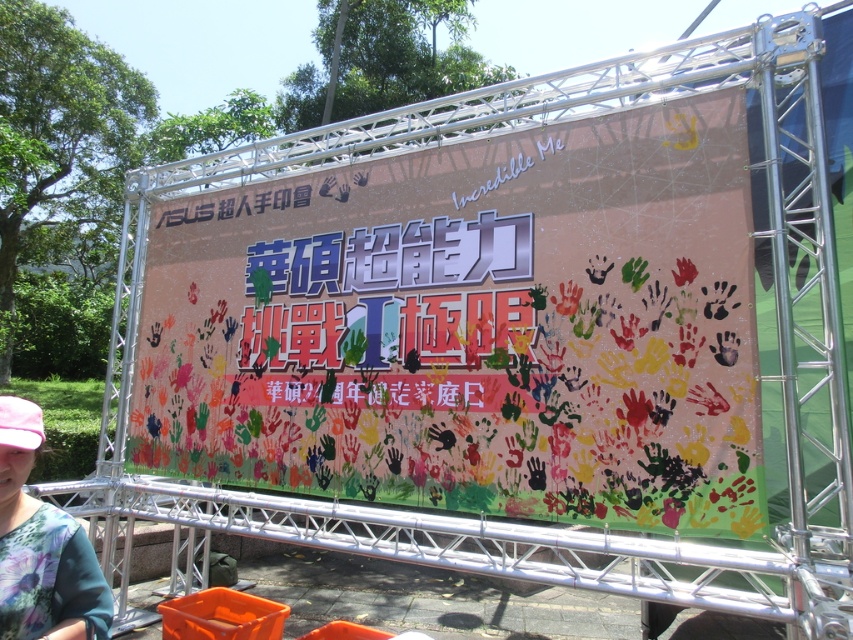
Question: Can you confirm if floral fabric shirt at lower left is positioned to the left of orange plastic crate at lower center?

Choices:
 (A) no
 (B) yes

Answer: (B)

Question: Which object is positioned farthest from the multicolored painted hands at center?

Choices:
 (A) floral fabric shirt at lower left
 (B) orange plastic crate at lower center

Answer: (A)

Question: Is multicolored painted hands at center below floral fabric shirt at lower left?

Choices:
 (A) yes
 (B) no

Answer: (B)

Question: Does multicolored painted hands at center appear over floral fabric shirt at lower left?

Choices:
 (A) no
 (B) yes

Answer: (B)

Question: Which of the following is the farthest from the observer?

Choices:
 (A) (228, 632)
 (B) (10, 483)

Answer: (A)

Question: Estimate the real-world distances between objects in this image. Which object is farther from the floral fabric shirt at lower left?

Choices:
 (A) multicolored painted hands at center
 (B) orange plastic crate at lower center

Answer: (A)